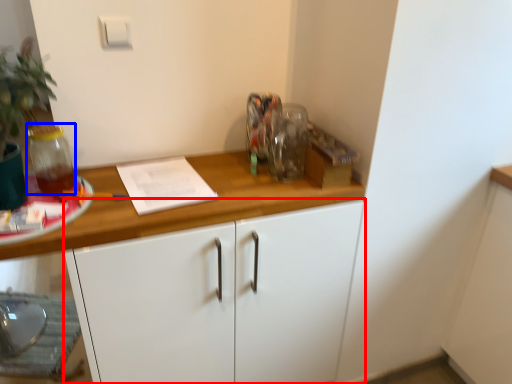
Question: Which of the following is the closest to the observer, cabinetry (highlighted by a red box) or glass jar (highlighted by a blue box)?

Choices:
 (A) cabinetry
 (B) glass jar

Answer: (A)